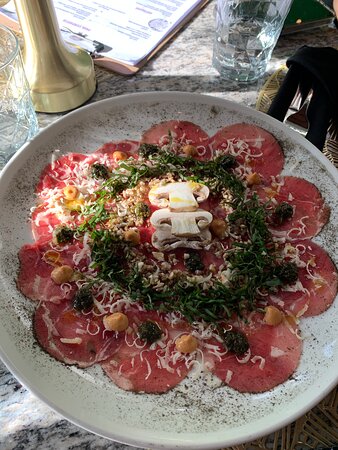
The height and width of the screenshot is (450, 338). Find the location of `plate`. plate is located at coordinates (93, 413).